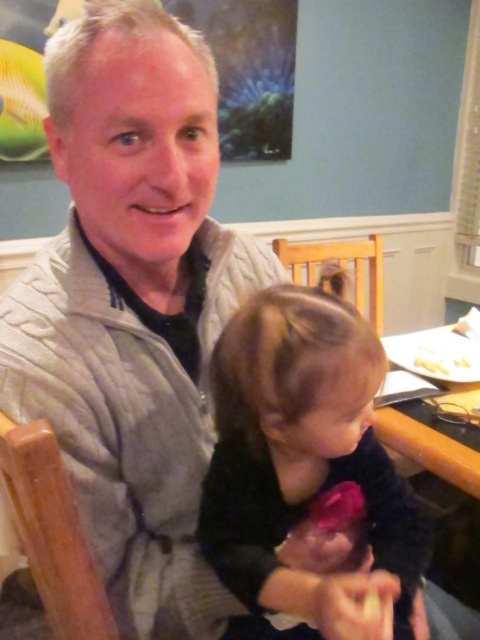
You are a photographer setting up for a family portrait. You need to position a camera on a tripod so that both the wooden table at center and the white matte plate at upper right are in the frame. Based on their positions, which object should be closer to the camera?

The wooden table at center is in front of the white matte plate at upper right, so the wooden table at center is closer to the camera.

You are a photographer setting up for a family portrait. You have to place a decorative vase between the wooden table at center and the white matte plate at upper right. Based on their positions, where should you place the vase so it is equidistant from both objects?

The wooden table at center is to the left of the white matte plate at upper right, so placing the vase exactly halfway between them would ensure it is equidistant from both objects.

You are a guest at this dinner and want to place your napkin on the table. Which object should you use as a reference to ensure it stays on the wooden table at center and not the white matte plate at upper right?

The wooden table at center is bigger than the white matte plate at upper right, so placing the napkin on the larger surface will ensure it stays on the wooden table at center rather than the smaller plate.